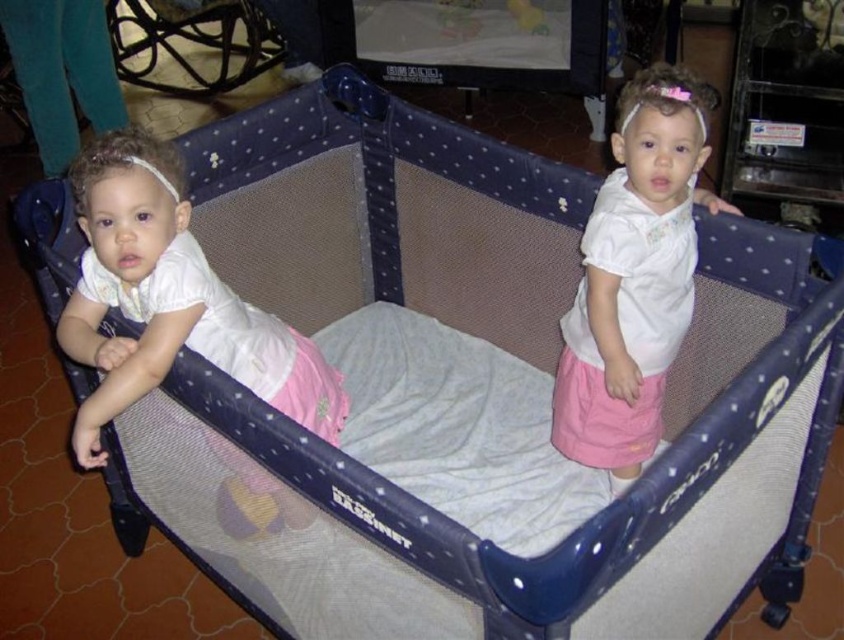
Looking at this image, does matte white dress at left appear over white matte shirt at upper center?

No, matte white dress at left is not above white matte shirt at upper center.

Which of these two, matte white dress at left or white matte shirt at upper center, stands taller?

white matte shirt at upper center

Where is `matte white dress at left`? matte white dress at left is located at coordinates (169, 300).

Locate an element on the screen. The width and height of the screenshot is (844, 640). matte white dress at left is located at coordinates (169, 300).